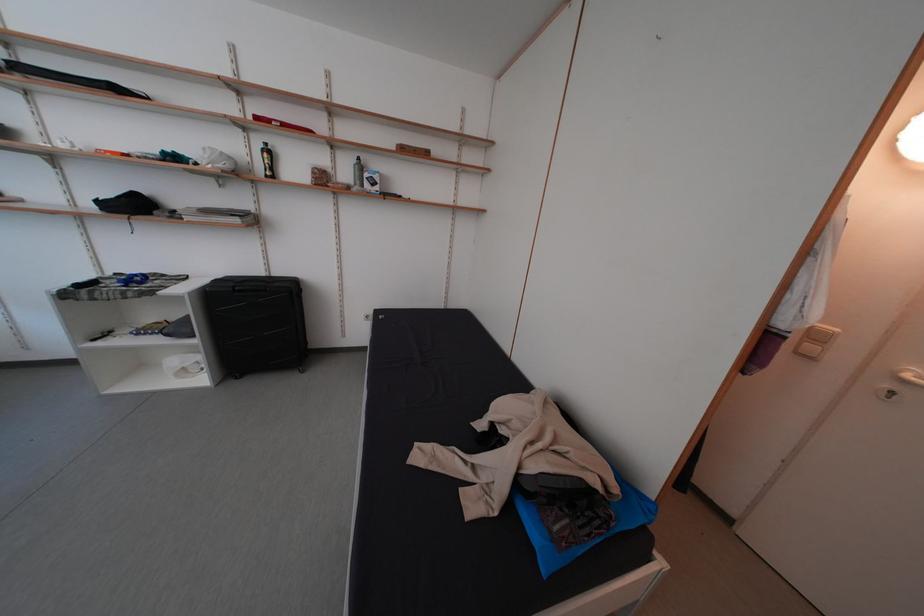
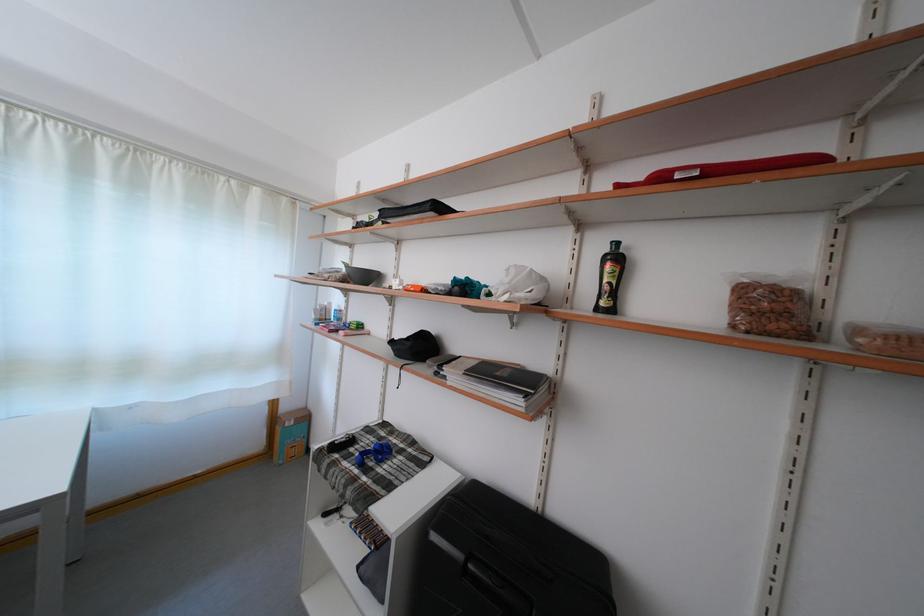
Where in the second image is the point corresponding to [332,185] from the first image?

(782, 321)